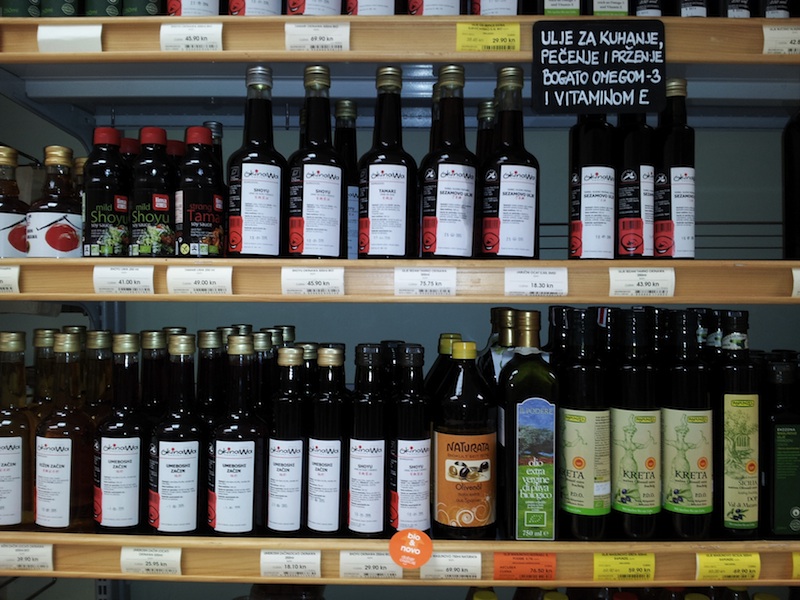
I want to click on shelves, so click(x=137, y=29), click(x=256, y=277), click(x=222, y=557).